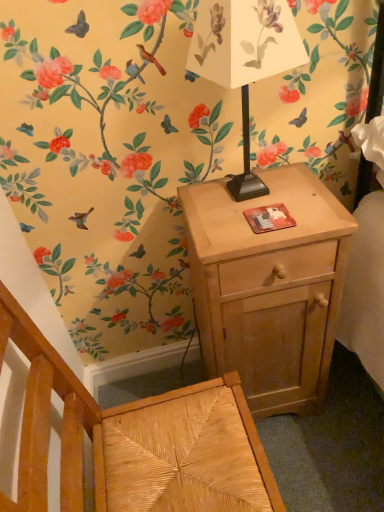
The width and height of the screenshot is (384, 512). I want to click on empty space that is ontop of light wood nightstand at right (from a real-world perspective), so click(x=257, y=206).